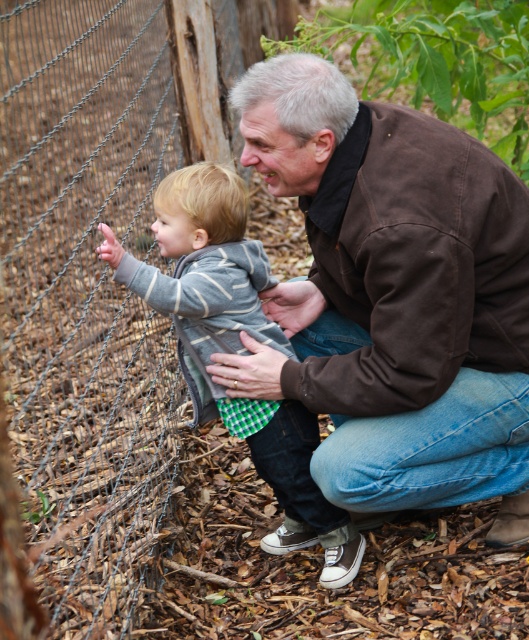
Question: Based on their relative distances, which object is nearer to the wire mesh fence at left?

Choices:
 (A) striped cotton sweater at center
 (B) brown leather jacket at center

Answer: (A)

Question: Which of these objects is positioned closest to the wire mesh fence at left?

Choices:
 (A) striped cotton sweater at center
 (B) brown leather jacket at center

Answer: (A)

Question: Does brown leather jacket at center appear on the left side of wire mesh fence at left?

Choices:
 (A) no
 (B) yes

Answer: (A)

Question: In this image, where is brown leather jacket at center located relative to wire mesh fence at left?

Choices:
 (A) left
 (B) right

Answer: (B)

Question: In this image, where is brown leather jacket at center located relative to striped cotton sweater at center?

Choices:
 (A) right
 (B) left

Answer: (A)

Question: Among these points, which one is nearest to the camera?

Choices:
 (A) (131, 536)
 (B) (206, 348)

Answer: (B)